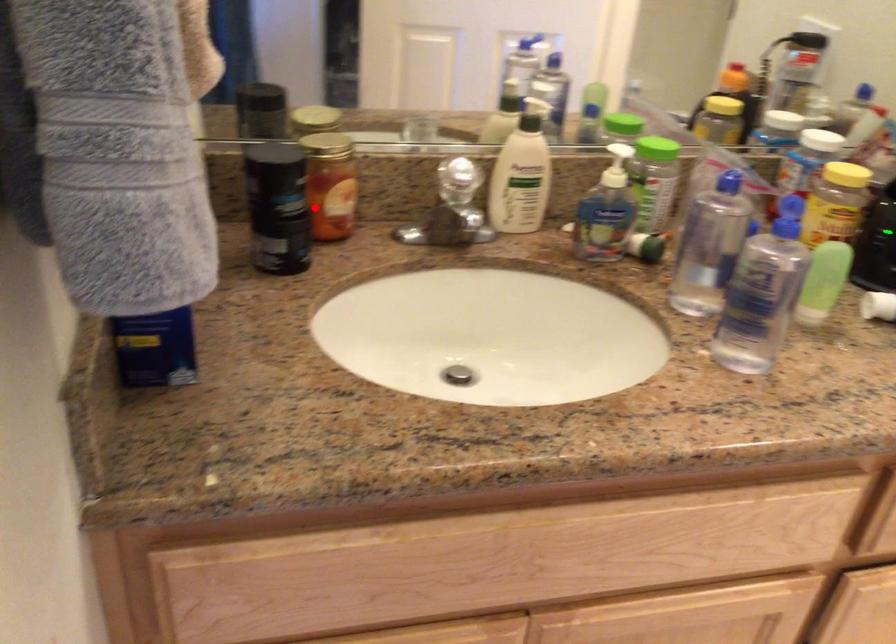
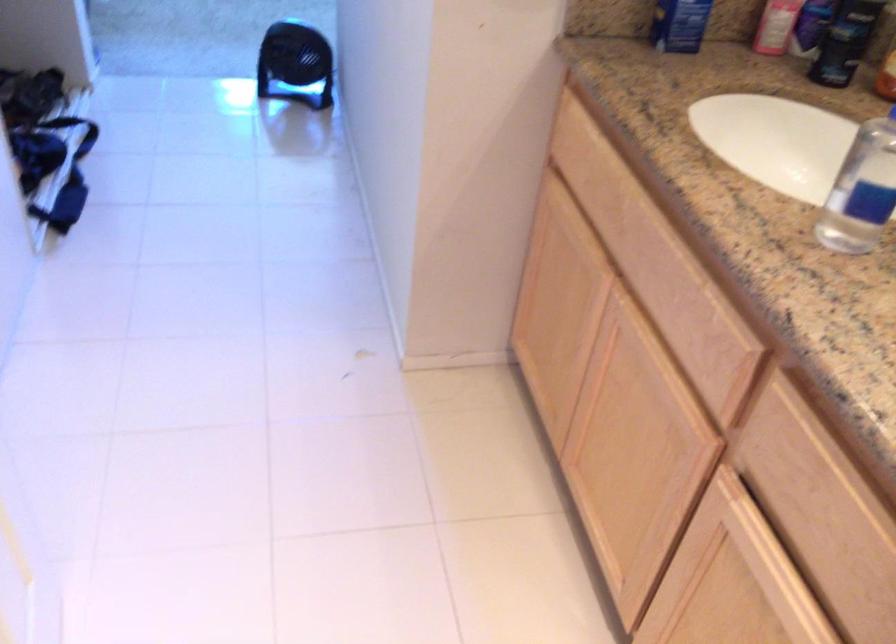
Question: I am providing you with two images of the same scene from different viewpoints. Given a red point in image1, look at the same physical point in image2. Is it:

Choices:
 (A) Closer to the viewpoint
 (B) Farther from the viewpoint

Answer: (B)